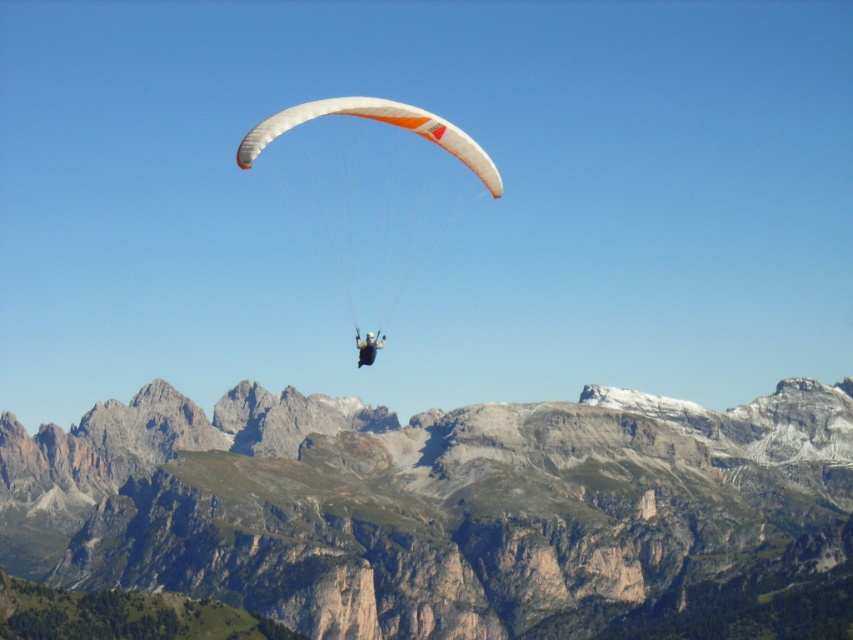
Question: From the image, what is the correct spatial relationship of rugged stone mountain range at center in relation to matte black paraglider at center?

Choices:
 (A) right
 (B) left

Answer: (A)

Question: Which is nearer to the matte black paraglider at center?

Choices:
 (A) rugged stone mountain range at center
 (B) white matte parachute at center

Answer: (B)

Question: Which point is closer to the camera?

Choices:
 (A) matte black paraglider at center
 (B) rugged stone mountain range at center
 (C) white matte parachute at center

Answer: (C)

Question: Does rugged stone mountain range at center appear on the right side of matte black paraglider at center?

Choices:
 (A) no
 (B) yes

Answer: (B)

Question: Which of these objects is positioned farthest from the white matte parachute at center?

Choices:
 (A) rugged stone mountain range at center
 (B) matte black paraglider at center

Answer: (A)

Question: Can you confirm if rugged stone mountain range at center is bigger than matte black paraglider at center?

Choices:
 (A) no
 (B) yes

Answer: (B)